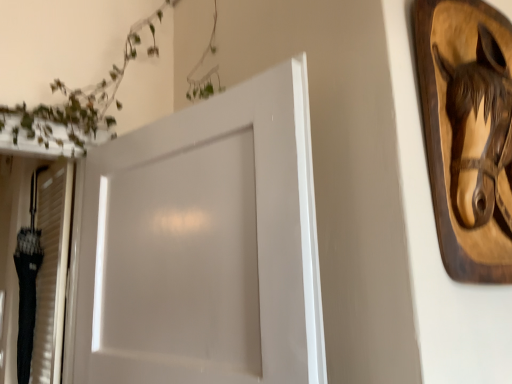
Measure the distance between wooden horse head at upper right and camera.

A distance of 29.90 inches exists between wooden horse head at upper right and camera.

Find the location of a particular element. wooden horse head at upper right is located at coordinates (479, 133).

This screenshot has width=512, height=384. What do you see at coordinates (479, 133) in the screenshot? I see `wooden horse head at upper right` at bounding box center [479, 133].

Describe the element at coordinates (202, 245) in the screenshot. The image size is (512, 384). I see `white glossy door at center` at that location.

Measure the distance between point (210, 198) and camera.

They are 94.80 centimeters apart.

Where is `white glossy door at center`? The height and width of the screenshot is (384, 512). white glossy door at center is located at coordinates (202, 245).

Measure the distance between white glossy door at center and camera.

A distance of 71.04 centimeters exists between white glossy door at center and camera.

The width and height of the screenshot is (512, 384). Identify the location of wooden horse head at upper right. (479, 133).

Considering the positions of objects white glossy door at center and wooden horse head at upper right in the image provided, who is more to the right, white glossy door at center or wooden horse head at upper right?

From the viewer's perspective, wooden horse head at upper right appears more on the right side.

Which object is more forward, white glossy door at center or wooden horse head at upper right?

white glossy door at center is closer to the camera.

Considering the positions of point (97, 176) and point (477, 60), is point (97, 176) closer or farther from the camera than point (477, 60)?

Point (97, 176) is positioned farther from the camera compared to point (477, 60).

From the image's perspective, does white glossy door at center appear higher than wooden horse head at upper right?

Actually, white glossy door at center appears below wooden horse head at upper right in the image.

From a real-world perspective, does white glossy door at center sit lower than wooden horse head at upper right?

Yes, from a real-world perspective, white glossy door at center is below wooden horse head at upper right.

From the picture: Which object is wider, white glossy door at center or wooden horse head at upper right?

Wider between the two is white glossy door at center.

In terms of height, does white glossy door at center look taller or shorter compared to wooden horse head at upper right?

Clearly, white glossy door at center is taller compared to wooden horse head at upper right.

Is white glossy door at center smaller than wooden horse head at upper right?

No.

Would you say white glossy door at center contains wooden horse head at upper right?

Actually, wooden horse head at upper right is outside white glossy door at center.

Is white glossy door at center far from wooden horse head at upper right?

No, white glossy door at center is not far away from wooden horse head at upper right.

Is white glossy door at center oriented towards wooden horse head at upper right?

No, white glossy door at center does not turn towards wooden horse head at upper right.

What's the angular difference between white glossy door at center and wooden horse head at upper right's facing directions?

There is a 75.2-degree angle between the facing directions of white glossy door at center and wooden horse head at upper right.

Measure the distance from white glossy door at center to wooden horse head at upper right.

white glossy door at center and wooden horse head at upper right are 20.41 inches apart from each other.

I want to click on door below the wooden horse head at upper right (from the image's perspective), so click(202, 245).

Visually, is wooden horse head at upper right positioned to the left or to the right of white glossy door at center?

Based on their positions, wooden horse head at upper right is located to the right of white glossy door at center.

Between wooden horse head at upper right and white glossy door at center, which one is positioned behind?

wooden horse head at upper right is further away from the camera.

Is point (510, 120) closer or farther from the camera than point (258, 275)?

Clearly, point (510, 120) is more distant from the camera than point (258, 275).

From the image's perspective, is wooden horse head at upper right positioned above or below white glossy door at center?

wooden horse head at upper right is above white glossy door at center.

Based on the photo, from a real-world perspective, is wooden horse head at upper right on white glossy door at center?

Indeed, from a real-world perspective, wooden horse head at upper right stands above white glossy door at center.

Is wooden horse head at upper right wider or thinner than white glossy door at center?

Considering their sizes, wooden horse head at upper right looks slimmer than white glossy door at center.

Considering the relative sizes of wooden horse head at upper right and white glossy door at center in the image provided, is wooden horse head at upper right taller than white glossy door at center?

No, wooden horse head at upper right is not taller than white glossy door at center.

Considering the sizes of objects wooden horse head at upper right and white glossy door at center in the image provided, who is bigger, wooden horse head at upper right or white glossy door at center?

Bigger between the two is white glossy door at center.

Is wooden horse head at upper right outside of white glossy door at center?

Yes, wooden horse head at upper right is outside of white glossy door at center.

Is wooden horse head at upper right next to white glossy door at center and touching it?

wooden horse head at upper right and white glossy door at center are not in contact.

Is wooden horse head at upper right positioned with its back to white glossy door at center?

wooden horse head at upper right is not turned away from white glossy door at center.

Can you tell me how much wooden horse head at upper right and white glossy door at center differ in facing direction?

The facing directions of wooden horse head at upper right and white glossy door at center are 75.2 degrees apart.

Locate an element on the screen. This screenshot has width=512, height=384. door beneath the wooden horse head at upper right (from a real-world perspective) is located at coordinates (202, 245).

I want to click on door in front of the wooden horse head at upper right, so click(x=202, y=245).

This screenshot has width=512, height=384. I want to click on animal lying on the right of white glossy door at center, so [479, 133].